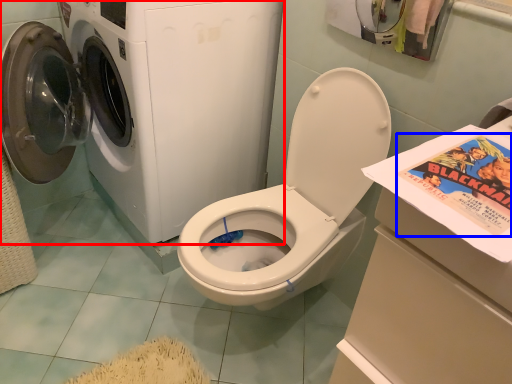
Question: Among these objects, which one is nearest to the camera, washing machine (highlighted by a red box) or comic book (highlighted by a blue box)?

Choices:
 (A) washing machine
 (B) comic book

Answer: (B)